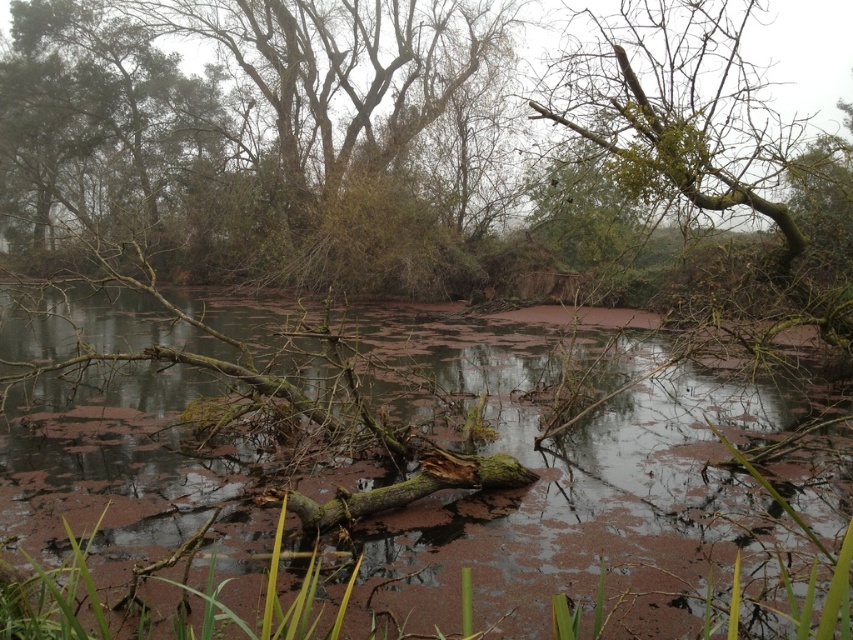
Question: Which point is farther from the camera taking this photo?

Choices:
 (A) (677, 195)
 (B) (699, 406)

Answer: (B)

Question: Which point is farther to the camera?

Choices:
 (A) brown mossy log at center
 (B) green mossy branch at upper right

Answer: (B)

Question: Can you confirm if brown mossy log at center is bigger than green mossy branch at upper right?

Choices:
 (A) yes
 (B) no

Answer: (A)

Question: Can you confirm if brown mossy log at center is wider than green mossy branch at upper right?

Choices:
 (A) yes
 (B) no

Answer: (A)

Question: Which point appears farthest from the camera in this image?

Choices:
 (A) (x=144, y=401)
 (B) (x=682, y=160)

Answer: (A)

Question: Is brown mossy log at center positioned in front of green mossy branch at upper right?

Choices:
 (A) no
 (B) yes

Answer: (B)